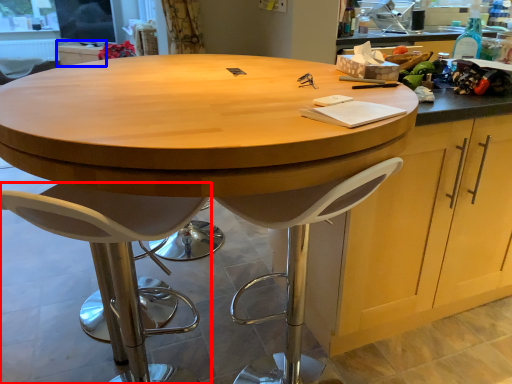
Question: Among these objects, which one is farthest to the camera, chair (highlighted by a red box) or cabinetry (highlighted by a blue box)?

Choices:
 (A) chair
 (B) cabinetry

Answer: (B)